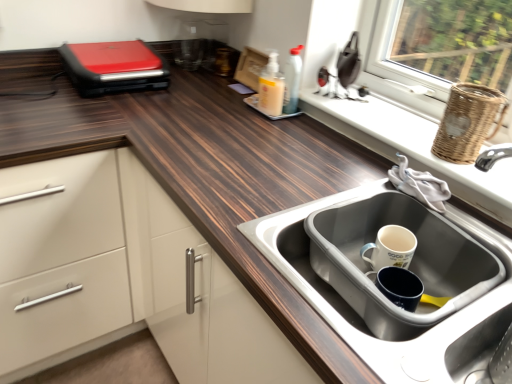
I want to click on vacant space behind woven brown basket at upper right, so 410,123.